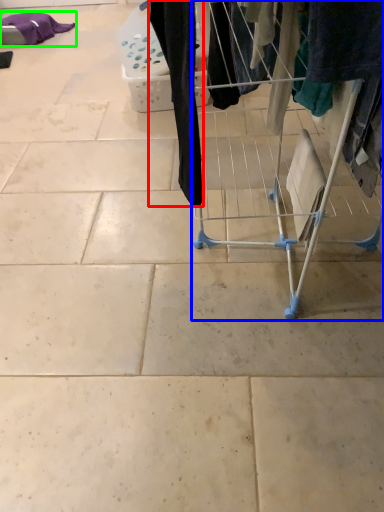
Question: Considering the real-world distances, which object is closest to clothing (highlighted by a red box)? furniture (highlighted by a blue box) or clothing (highlighted by a green box).

Choices:
 (A) furniture
 (B) clothing

Answer: (A)